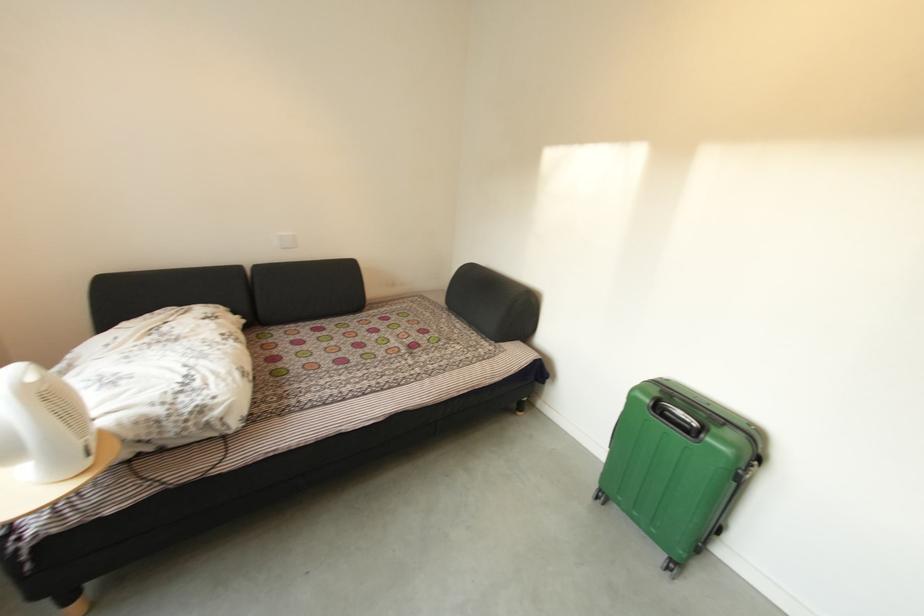
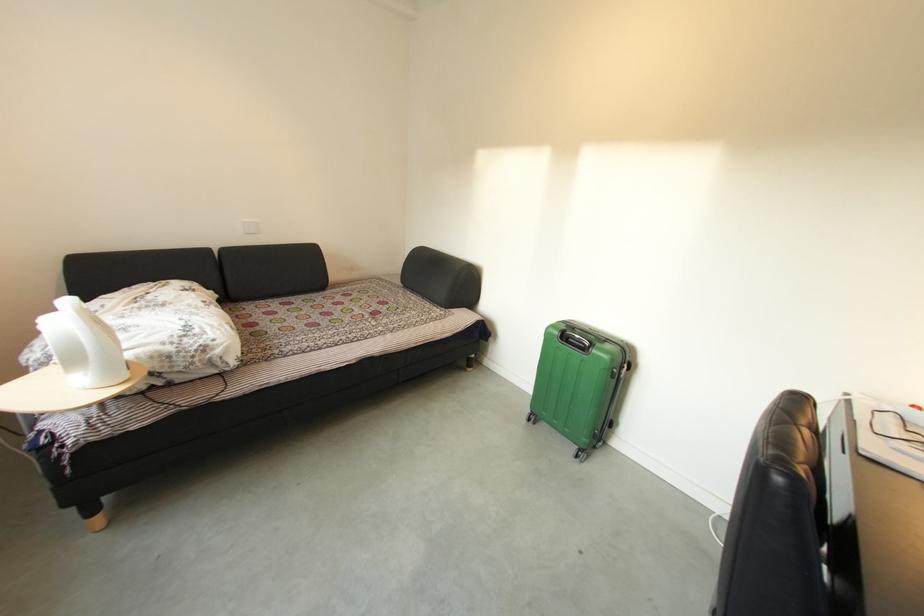
In the second image, find the point that corresponds to point 254,325 in the first image.

(228, 300)